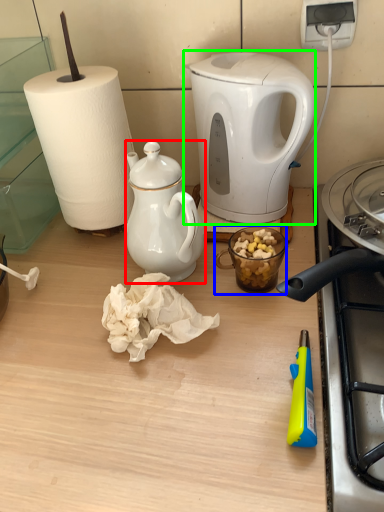
Question: Estimate the real-world distances between objects in this image. Which object is closer to teapot (highlighted by a red box), coffee cup (highlighted by a blue box) or kettle (highlighted by a green box)?

Choices:
 (A) coffee cup
 (B) kettle

Answer: (A)